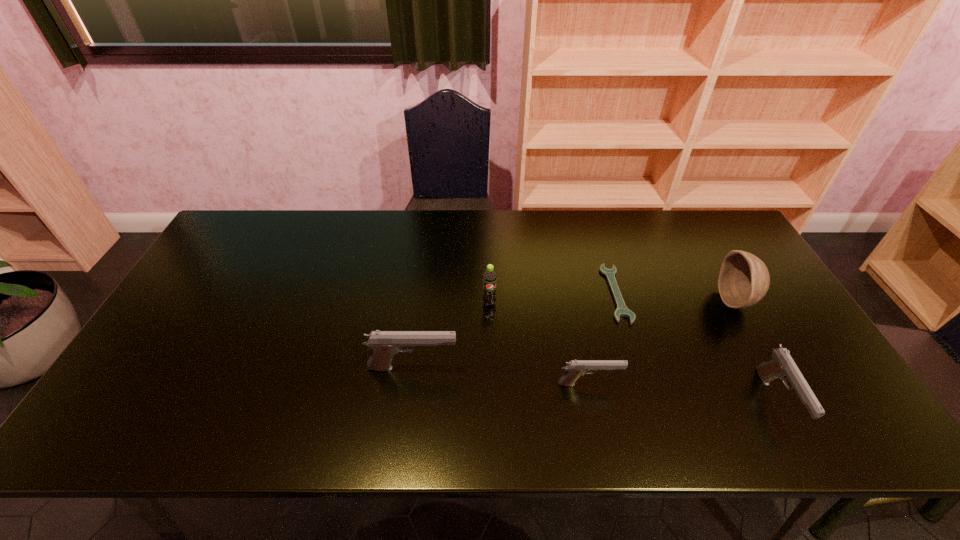
Identify the location of free space for a new pistol on the left. The image size is (960, 540). (248, 353).